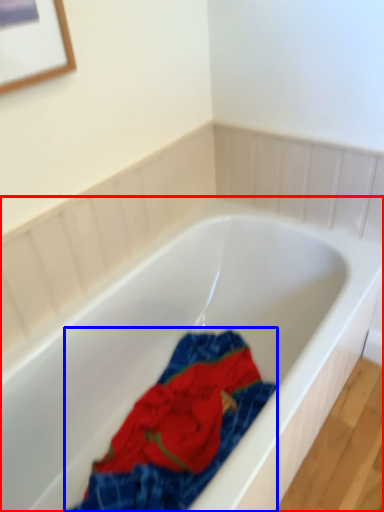
Question: Which object is further to the camera taking this photo, bathtub (highlighted by a red box) or material (highlighted by a blue box)?

Choices:
 (A) bathtub
 (B) material

Answer: (B)